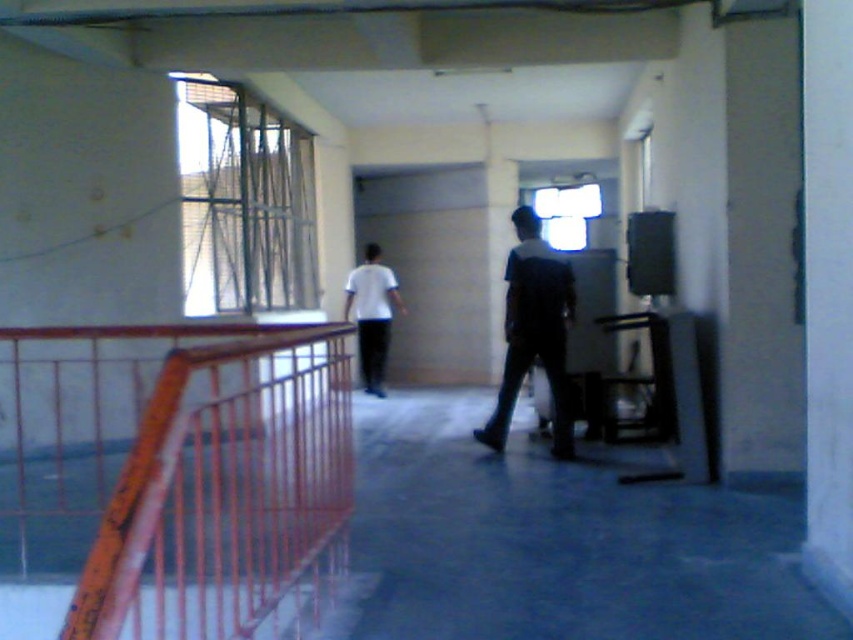
You are standing in the corridor and see two shirts hanging on a rack at the center. The shirts are described as dark blue fabric shirt at center and white matte shirt at center. Which shirt is positioned to the right when viewed from your perspective?

The dark blue fabric shirt at center is positioned to the right of the white matte shirt at center.

You are a fashion designer observing two shirts displayed in the corridor. The dark blue fabric shirt at center and the white matte shirt at center. Which shirt is taller?

The dark blue fabric shirt at center is much taller than the white matte shirt at center.